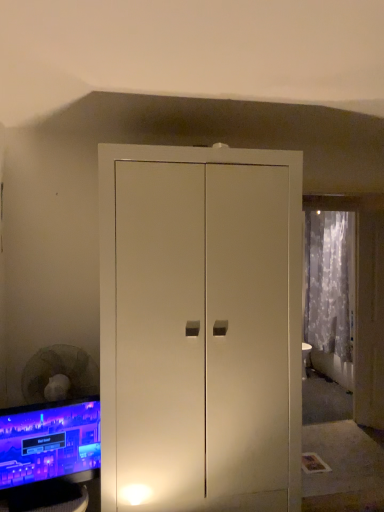
Question: Is translucent fabric curtain at right situated inside matte black monitor at lower left or outside?

Choices:
 (A) inside
 (B) outside

Answer: (B)

Question: From the image's perspective, is translucent fabric curtain at right above or below matte black monitor at lower left?

Choices:
 (A) below
 (B) above

Answer: (B)

Question: Based on their sizes in the image, would you say translucent fabric curtain at right is bigger or smaller than matte black monitor at lower left?

Choices:
 (A) small
 (B) big

Answer: (B)

Question: From a real-world perspective, is matte black monitor at lower left physically located above or below translucent fabric curtain at right?

Choices:
 (A) above
 (B) below

Answer: (B)

Question: Considering the positions of point (21, 493) and point (319, 323), is point (21, 493) closer or farther from the camera than point (319, 323)?

Choices:
 (A) farther
 (B) closer

Answer: (B)

Question: Is matte black monitor at lower left situated inside translucent fabric curtain at right or outside?

Choices:
 (A) outside
 (B) inside

Answer: (A)

Question: Based on their positions, is matte black monitor at lower left located to the left or right of translucent fabric curtain at right?

Choices:
 (A) left
 (B) right

Answer: (A)